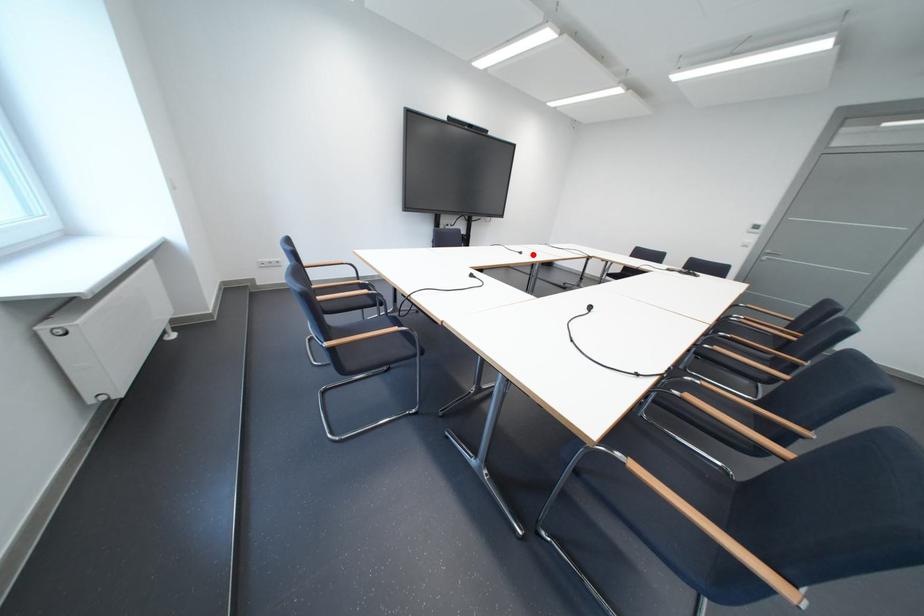
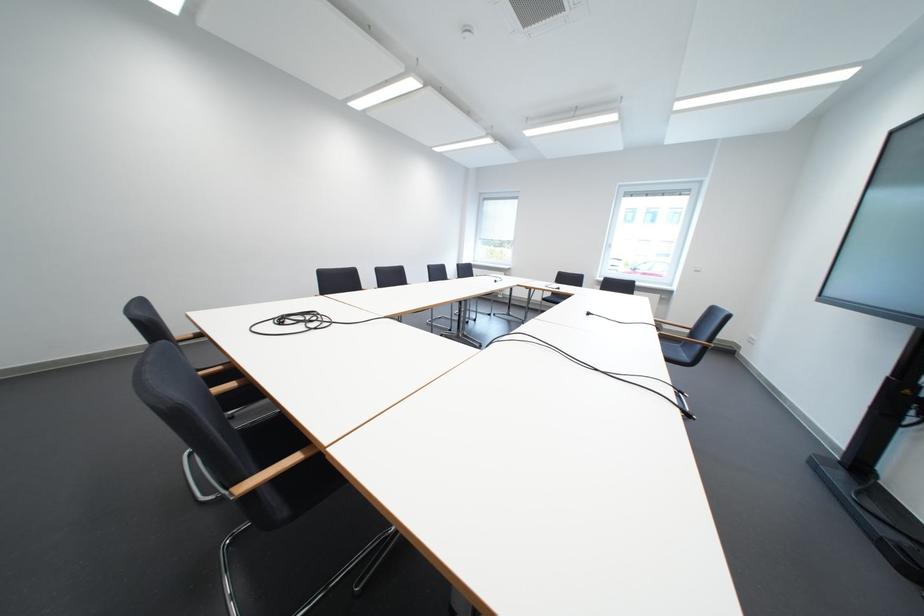
In the second image, find the point that corresponds to the highlighted location in the first image.

(601, 315)